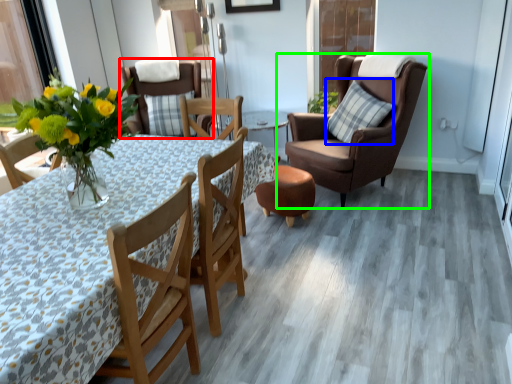
Question: Estimate the real-world distances between objects in this image. Which object is farther from chair (highlighted by a red box), pillow (highlighted by a blue box) or chair (highlighted by a green box)?

Choices:
 (A) pillow
 (B) chair

Answer: (A)